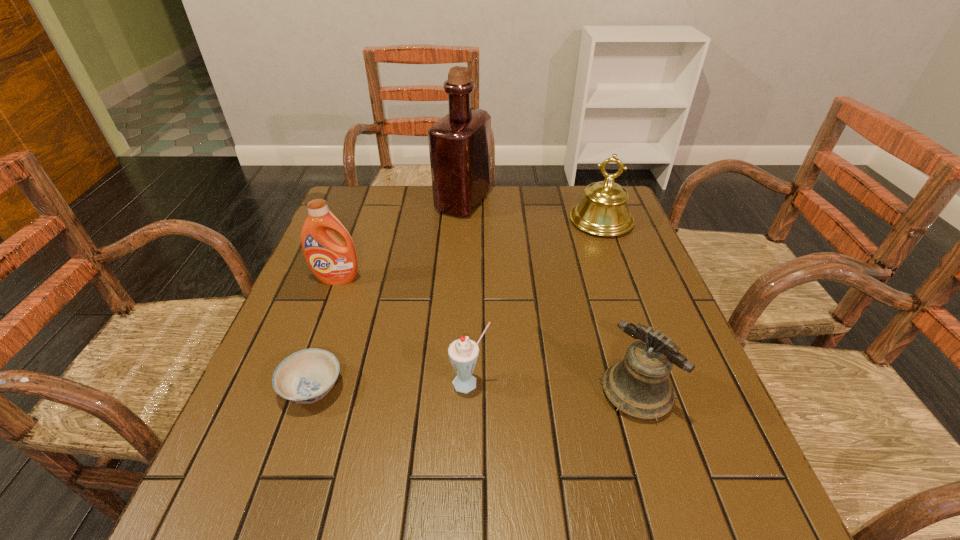
The width and height of the screenshot is (960, 540). Find the location of `free space between the tallest object and the shorter bell`. free space between the tallest object and the shorter bell is located at coordinates (549, 298).

Where is `free space that is in between the milkshake and the farther bell`? Image resolution: width=960 pixels, height=540 pixels. free space that is in between the milkshake and the farther bell is located at coordinates pyautogui.click(x=536, y=302).

Locate an element on the screen. vacant space that is in between the milkshake and the farther bell is located at coordinates (536, 302).

This screenshot has width=960, height=540. I want to click on object that is the second closest to the farther bell, so click(639, 386).

At what (x,y) coordinates should I click in order to perform the action: click on object that is the third closest to the fourth nearest object. Please return your answer as a coordinate pair (x, y). This screenshot has height=540, width=960. Looking at the image, I should click on (463, 353).

Find the location of a particular element. blank space that satisfies the following two spatial constraints: 1. on the front-facing side of the third farthest object; 2. on the right side of the shorter bell is located at coordinates pos(295,393).

You are a GUI agent. You are given a task and a screenshot of the screen. Output one action in this format:
    pyautogui.click(x=<x>, y=<y>)
    Task: Click on the vacant area that satisfies the following two spatial constraints: 1. on the back side of the taller bell; 2. on the left side of the nearer bell
    This screenshot has height=540, width=960.
    Given the screenshot: What is the action you would take?
    pyautogui.click(x=583, y=221)